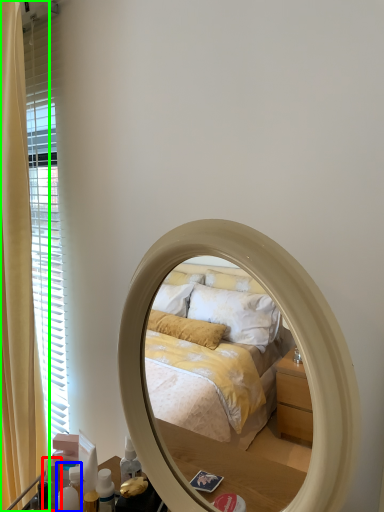
Question: Which object is positioned closest to toiletry (highlighted by a red box)? Select from toiletry (highlighted by a blue box) and curtain (highlighted by a green box).

Choices:
 (A) toiletry
 (B) curtain

Answer: (A)